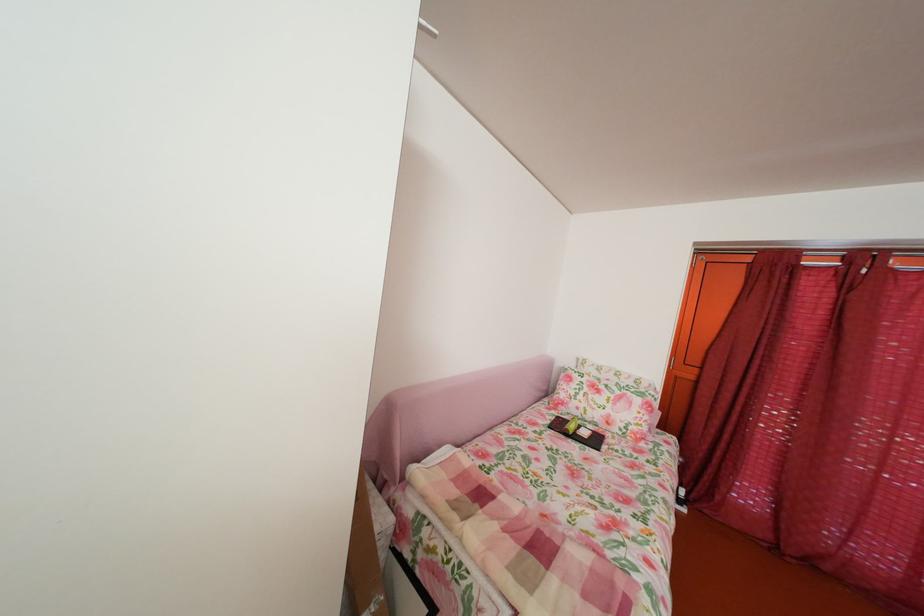
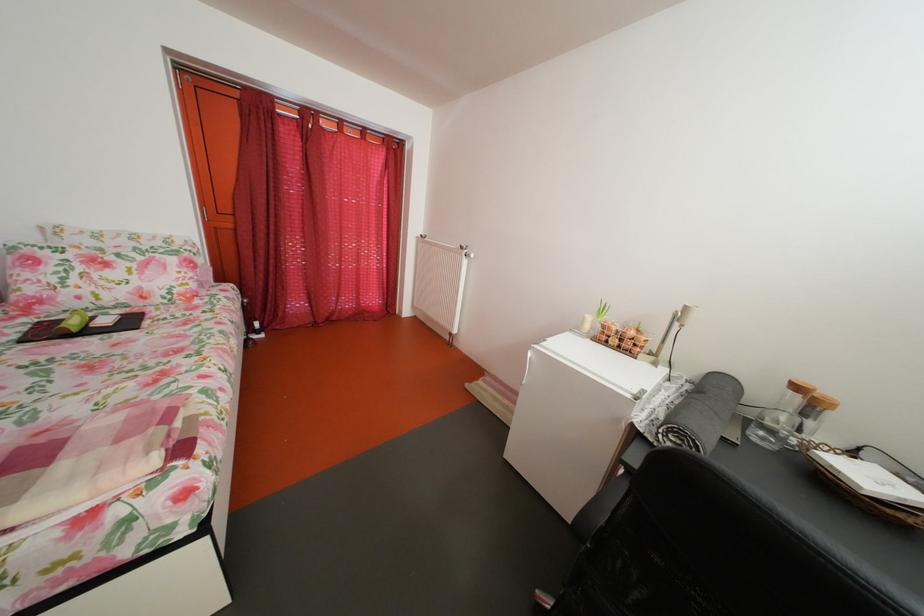
Where in the second image is the point corresponding to (582,434) from the first image?

(83, 330)